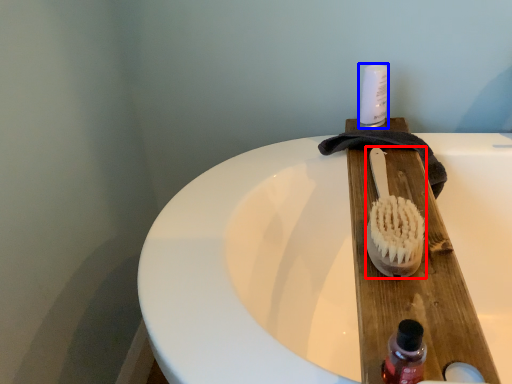
Question: Which point is further to the camera, brush (highlighted by a red box) or toiletry (highlighted by a blue box)?

Choices:
 (A) brush
 (B) toiletry

Answer: (B)